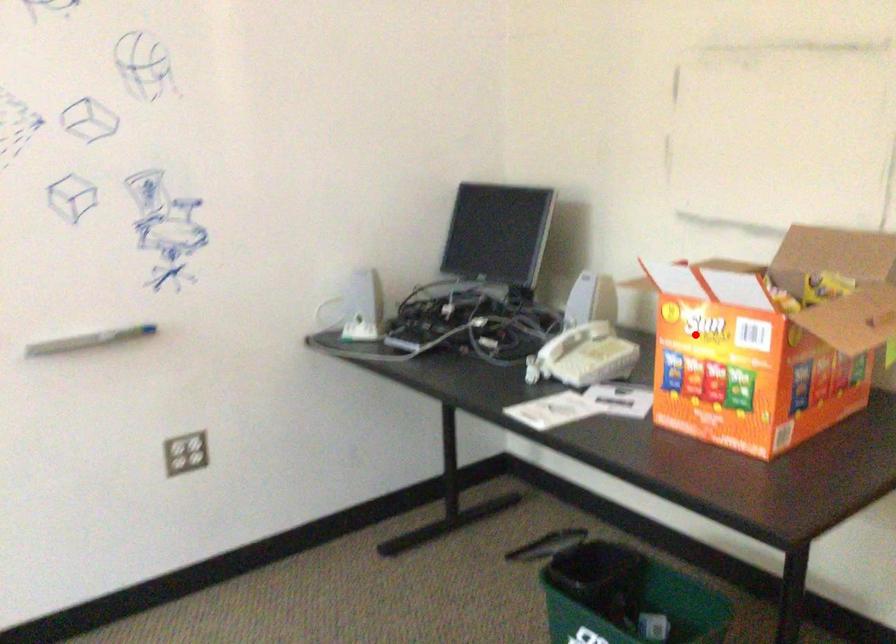
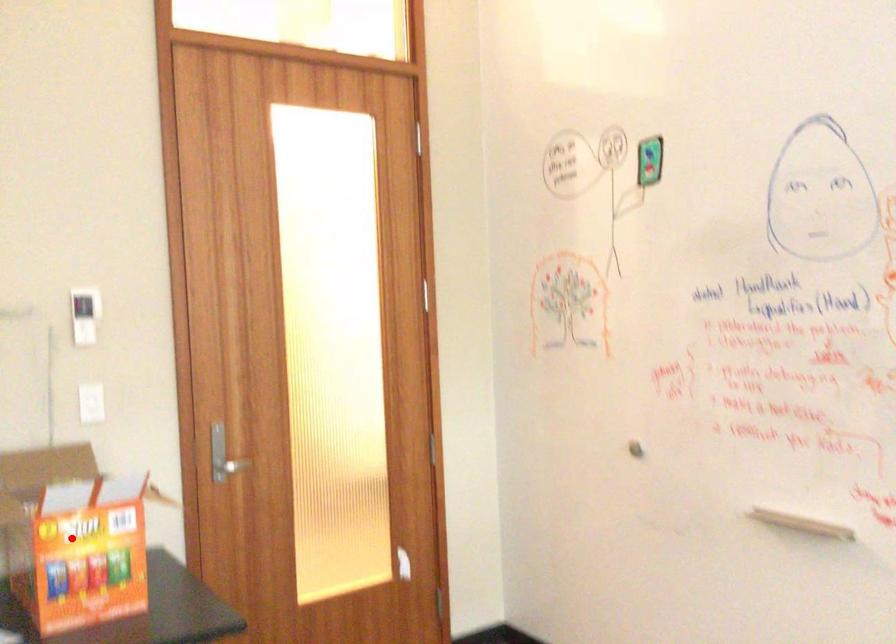
I am providing you with two images of the same scene from different viewpoints. A red point is marked on the first image and another point is marked on the second image. Is the red point in image1 aligned with the point shown in image2?

Yes